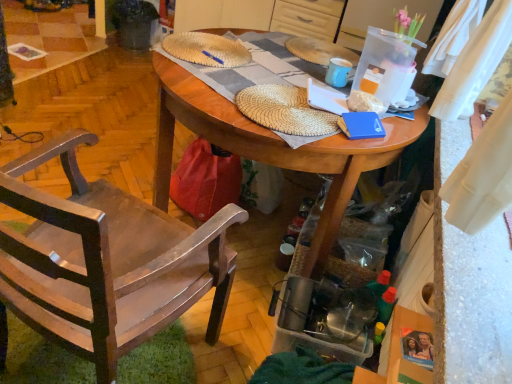
Question: Can you confirm if dark gray plastic trash can at upper left is bigger than blue matte book at center?

Choices:
 (A) yes
 (B) no

Answer: (A)

Question: Is dark gray plastic trash can at upper left touching blue matte book at center?

Choices:
 (A) no
 (B) yes

Answer: (A)

Question: Is the depth of dark gray plastic trash can at upper left greater than that of blue matte book at center?

Choices:
 (A) no
 (B) yes

Answer: (B)

Question: Does dark gray plastic trash can at upper left have a lesser width compared to blue matte book at center?

Choices:
 (A) no
 (B) yes

Answer: (A)

Question: From a real-world perspective, does dark gray plastic trash can at upper left stand above blue matte book at center?

Choices:
 (A) yes
 (B) no

Answer: (B)

Question: From the image's perspective, is blue plastic pen at center above or below matte blue mug at upper center?

Choices:
 (A) below
 (B) above

Answer: (B)

Question: Choose the correct answer: Is blue plastic pen at center inside matte blue mug at upper center or outside it?

Choices:
 (A) inside
 (B) outside

Answer: (B)

Question: Considering the positions of blue plastic pen at center and matte blue mug at upper center in the image, is blue plastic pen at center taller or shorter than matte blue mug at upper center?

Choices:
 (A) tall
 (B) short

Answer: (B)

Question: Would you say blue plastic pen at center is to the left or to the right of matte blue mug at upper center in the picture?

Choices:
 (A) right
 (B) left

Answer: (B)

Question: In terms of height, does wooden chair at left look taller or shorter compared to wooden table at center?

Choices:
 (A) tall
 (B) short

Answer: (A)

Question: Would you say wooden chair at left is to the left or to the right of wooden table at center in the picture?

Choices:
 (A) right
 (B) left

Answer: (B)

Question: In terms of width, does wooden chair at left look wider or thinner when compared to wooden table at center?

Choices:
 (A) thin
 (B) wide

Answer: (A)

Question: From the image's perspective, is wooden chair at left above or below wooden table at center?

Choices:
 (A) above
 (B) below

Answer: (B)

Question: In the image, is blue matte book at center positioned in front of or behind dark gray plastic trash can at upper left?

Choices:
 (A) behind
 (B) front

Answer: (B)

Question: From the image's perspective, is blue matte book at center positioned above or below dark gray plastic trash can at upper left?

Choices:
 (A) above
 (B) below

Answer: (B)